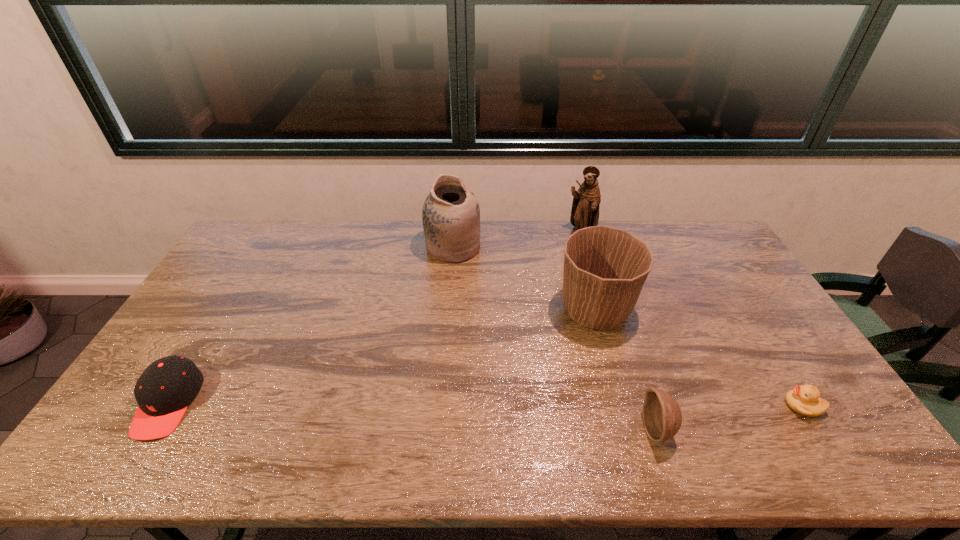
Where is `figurine`? The height and width of the screenshot is (540, 960). figurine is located at coordinates (585, 208).

The width and height of the screenshot is (960, 540). I want to click on pottery, so click(451, 215).

Identify the location of flowerpot. (605, 268).

Find the location of `the fourth tallest object`. the fourth tallest object is located at coordinates (662, 417).

Where is `the fifth tallest object`? This screenshot has width=960, height=540. the fifth tallest object is located at coordinates (164, 390).

Identify the location of cap. (164, 390).

This screenshot has width=960, height=540. Find the location of `the shortest object`. the shortest object is located at coordinates (805, 400).

The width and height of the screenshot is (960, 540). Find the location of `duckling`. duckling is located at coordinates (805, 400).

Where is `vacant area situated on the front-facing side of the figurine`? The image size is (960, 540). vacant area situated on the front-facing side of the figurine is located at coordinates (604, 315).

You are a GUI agent. You are given a task and a screenshot of the screen. Output one action in this format:
    pyautogui.click(x=<x>, y=<y>)
    Task: Click on the vacant region located on the right of the fifth object from right to left
    This screenshot has width=960, height=540.
    Given the screenshot: What is the action you would take?
    pyautogui.click(x=516, y=247)